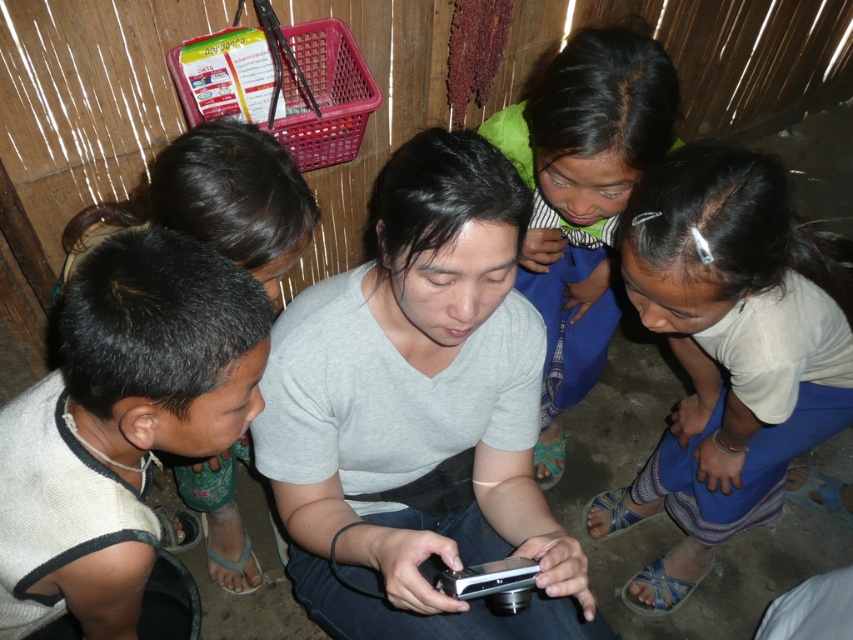
You are standing in the room and want to place a small decoration between the two points, point (x=543, y=392) and point (x=229, y=218). Which point should the decoration be closer to in order to appear centered from your viewpoint?

The decoration should be closer to point (x=229, y=218) because point (x=543, y=392) is further away from the camera, so positioning it nearer to the closer point would create a centered appearance from your viewpoint.